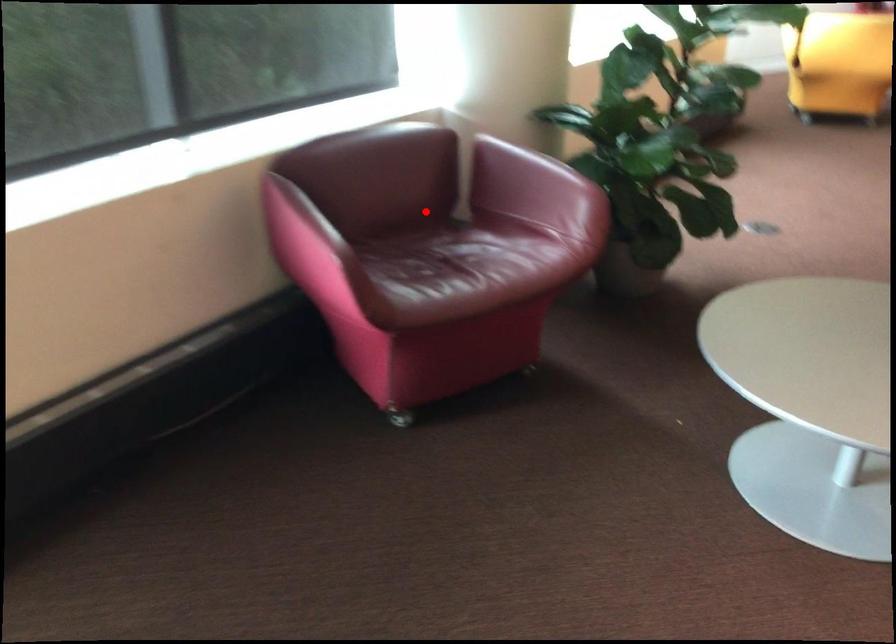
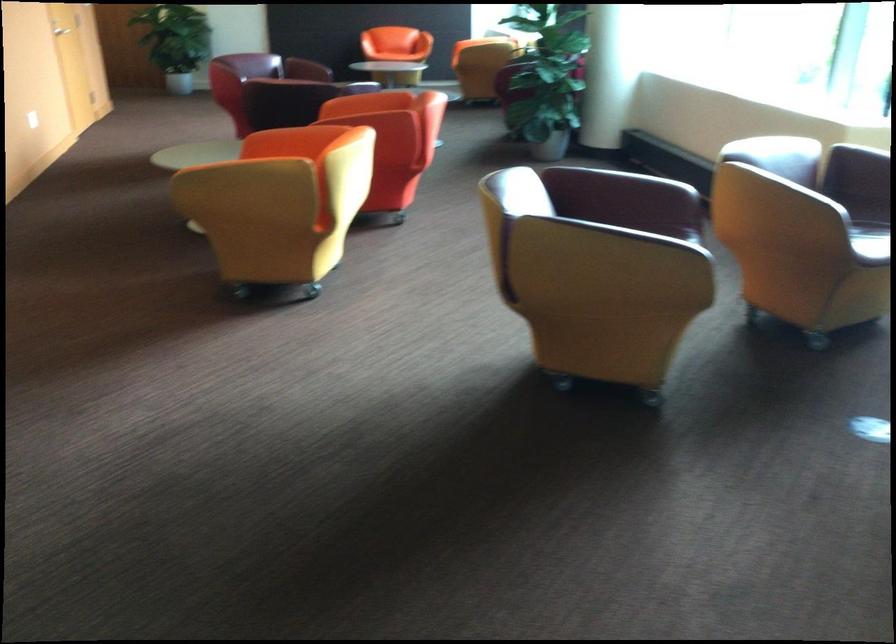
Question: I am providing you with two images of the same scene from different viewpoints. A red point is marked on the first image. Can you still see the location of the red point in image 2?

Choices:
 (A) Yes
 (B) No

Answer: (B)